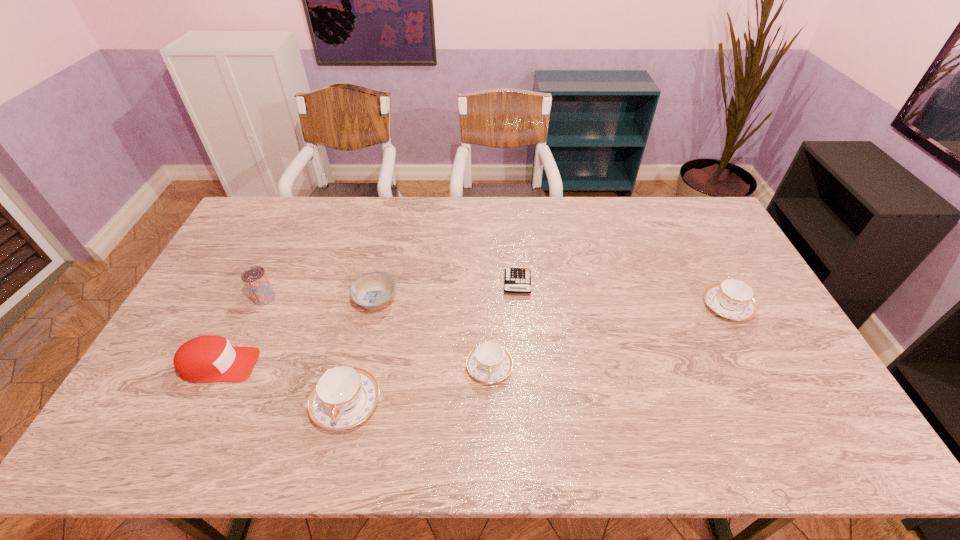
Identify the location of free spot located on the side with the handle of the farthest teacup. (692, 240).

Locate an element on the screen. vacant region located 0.190m on the front of the beer can is located at coordinates (236, 357).

Locate an element on the screen. This screenshot has height=540, width=960. free point located 0.270m on the right of the bowl is located at coordinates (486, 301).

What are the coordinates of `free space located 0.340m on the front-facing side of the baseball cap` in the screenshot? It's located at (382, 365).

At what (x,y) coordinates should I click in order to perform the action: click on free space located 0.220m on the front of the shortest object. Please return your answer as a coordinate pair (x, y). Looking at the image, I should click on (523, 356).

Where is `baseball cap at the near edge`? Image resolution: width=960 pixels, height=540 pixels. baseball cap at the near edge is located at coordinates (209, 358).

The width and height of the screenshot is (960, 540). What are the coordinates of `object located at the left edge` in the screenshot? It's located at (209, 358).

The width and height of the screenshot is (960, 540). What are the coordinates of `object that is at the right edge` in the screenshot? It's located at (x=732, y=298).

The image size is (960, 540). In order to click on object that is at the near left corner in this screenshot , I will do `click(209, 358)`.

Find the location of a particular element. The image size is (960, 540). free space at the far edge of the desktop is located at coordinates (500, 224).